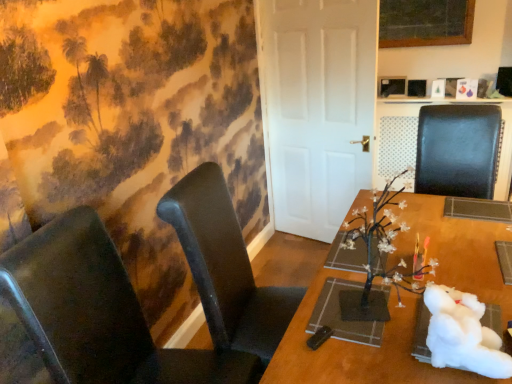
Question: From a real-world perspective, is black leather chair at left, which appears as the 2th chair when viewed from the right, under wooden table at center?

Choices:
 (A) yes
 (B) no

Answer: (B)

Question: Is black leather chair at left, the second chair viewed from the left, placed right next to wooden table at center?

Choices:
 (A) no
 (B) yes

Answer: (A)

Question: Can you confirm if black leather chair at left, the second chair viewed from the left, is bigger than wooden table at center?

Choices:
 (A) yes
 (B) no

Answer: (B)

Question: Is black leather chair at left, the second chair viewed from the left, not close to wooden table at center?

Choices:
 (A) yes
 (B) no

Answer: (B)

Question: Considering the relative sizes of black leather chair at left, the second chair viewed from the left, and wooden table at center in the image provided, is black leather chair at left, the second chair viewed from the left, thinner than wooden table at center?

Choices:
 (A) yes
 (B) no

Answer: (A)

Question: Is black leather chair at right, the first chair positioned from the right, inside the boundaries of black leather chair at left, the second chair viewed from the left, or outside?

Choices:
 (A) inside
 (B) outside

Answer: (B)

Question: Based on their sizes in the image, would you say black leather chair at right, marked as the 3th chair in a left-to-right arrangement, is bigger or smaller than black leather chair at left, which appears as the 2th chair when viewed from the right?

Choices:
 (A) big
 (B) small

Answer: (B)

Question: From the image's perspective, relative to black leather chair at left, which appears as the 2th chair when viewed from the right, is black leather chair at right, the first chair positioned from the right, above or below?

Choices:
 (A) below
 (B) above

Answer: (B)

Question: Visually, is black leather chair at right, the first chair positioned from the right, positioned to the left or to the right of black leather chair at left, which appears as the 2th chair when viewed from the right?

Choices:
 (A) right
 (B) left

Answer: (A)

Question: Is matte black chair at left, positioned as the 3th chair in right-to-left order, wider or thinner than black leather chair at left, the second chair viewed from the left?

Choices:
 (A) wide
 (B) thin

Answer: (A)

Question: Considering the positions of matte black chair at left, placed as the 1th chair when sorted from left to right, and black leather chair at left, the second chair viewed from the left, in the image, is matte black chair at left, placed as the 1th chair when sorted from left to right, taller or shorter than black leather chair at left, the second chair viewed from the left,?

Choices:
 (A) tall
 (B) short

Answer: (B)

Question: Is matte black chair at left, positioned as the 3th chair in right-to-left order, inside or outside of black leather chair at left, the second chair viewed from the left?

Choices:
 (A) outside
 (B) inside

Answer: (A)

Question: From the image's perspective, relative to black leather chair at left, which appears as the 2th chair when viewed from the right, is matte black chair at left, placed as the 1th chair when sorted from left to right, above or below?

Choices:
 (A) below
 (B) above

Answer: (A)

Question: Considering the positions of black leather chair at left, the second chair viewed from the left, and black leather chair at right, marked as the 3th chair in a left-to-right arrangement, in the image, is black leather chair at left, the second chair viewed from the left, wider or thinner than black leather chair at right, marked as the 3th chair in a left-to-right arrangement,?

Choices:
 (A) thin
 (B) wide

Answer: (B)

Question: From the image's perspective, is black leather chair at left, which appears as the 2th chair when viewed from the right, positioned above or below black leather chair at right, marked as the 3th chair in a left-to-right arrangement?

Choices:
 (A) below
 (B) above

Answer: (A)